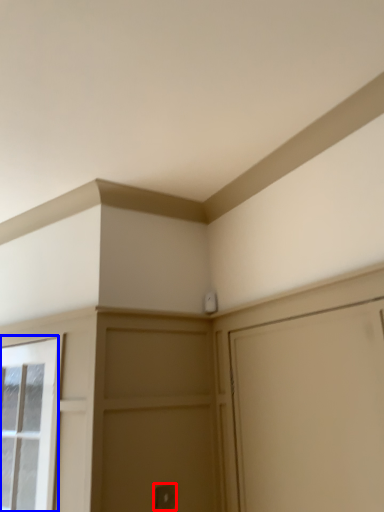
Question: Which point is further to the camera, door handle (highlighted by a red box) or window (highlighted by a blue box)?

Choices:
 (A) door handle
 (B) window

Answer: (A)